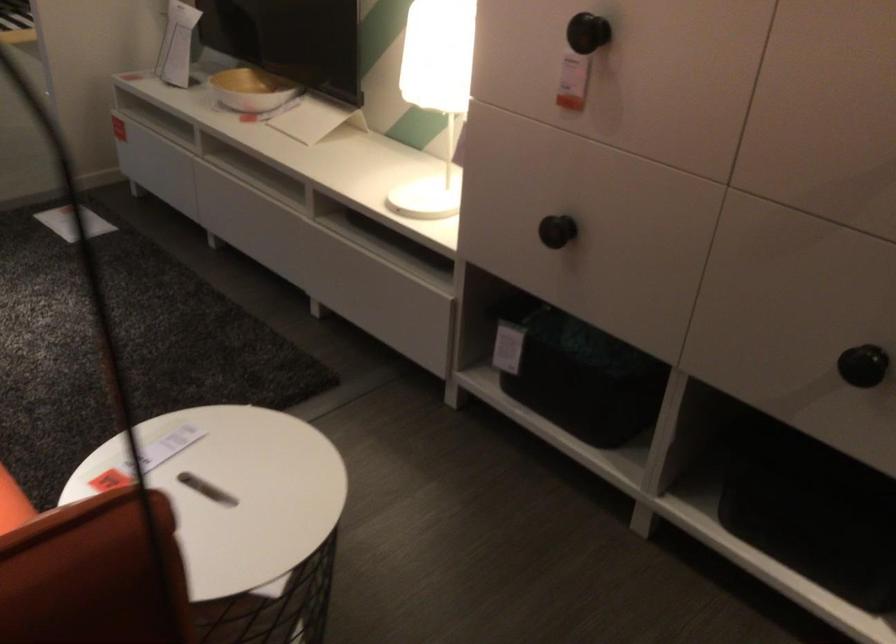
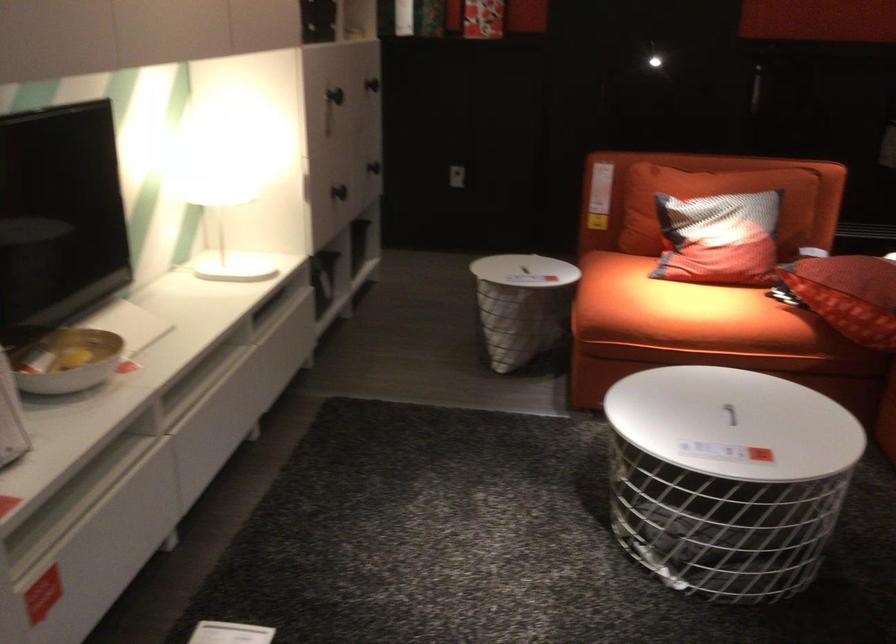
The point at (211, 471) is marked in the first image. Where is the corresponding point in the second image?

(522, 270)